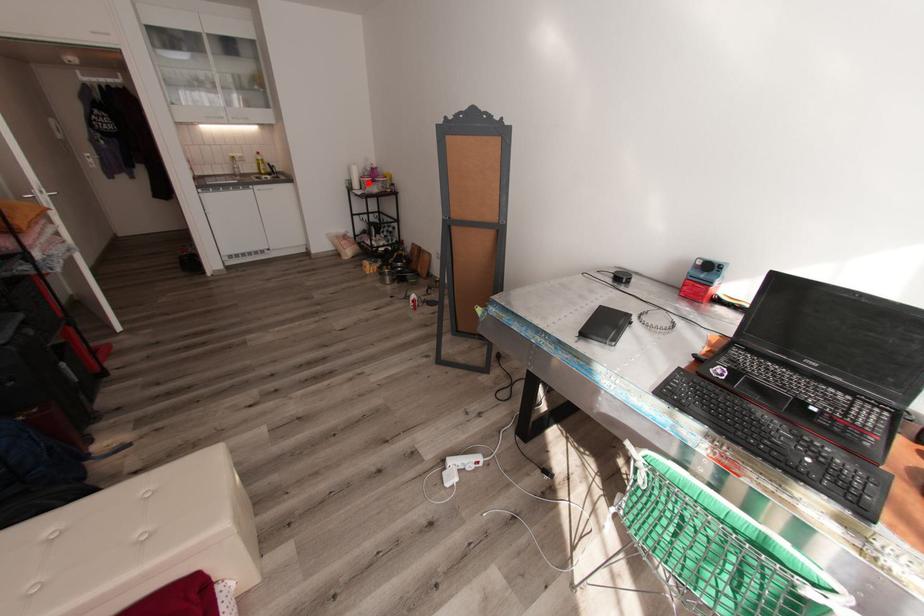
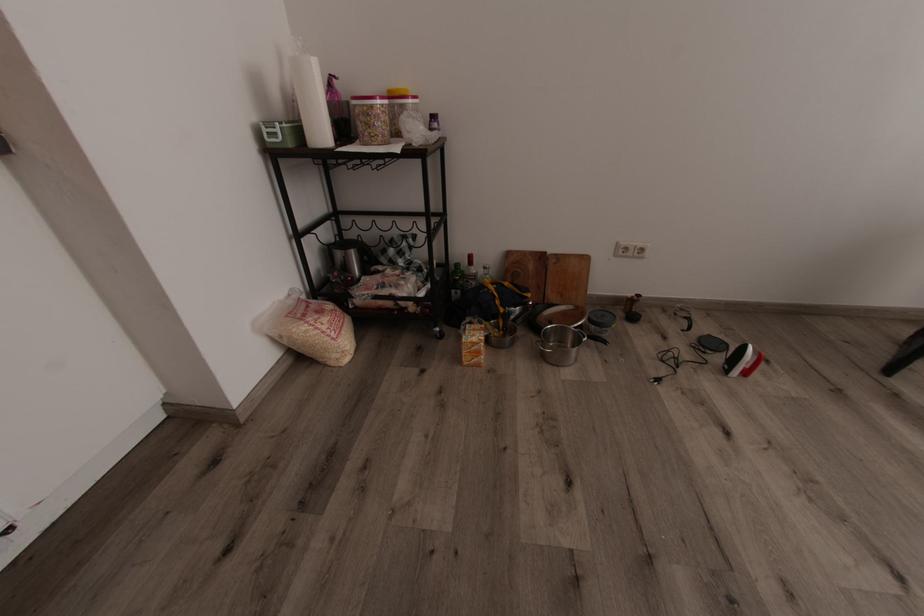
Where in the second image is the point corresponding to the highlighted location from the first image?

(382, 116)